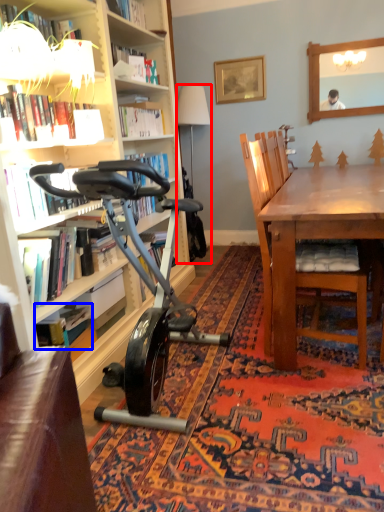
Question: Which object appears farthest to the camera in this image, lamp (highlighted by a red box) or book (highlighted by a blue box)?

Choices:
 (A) lamp
 (B) book

Answer: (A)